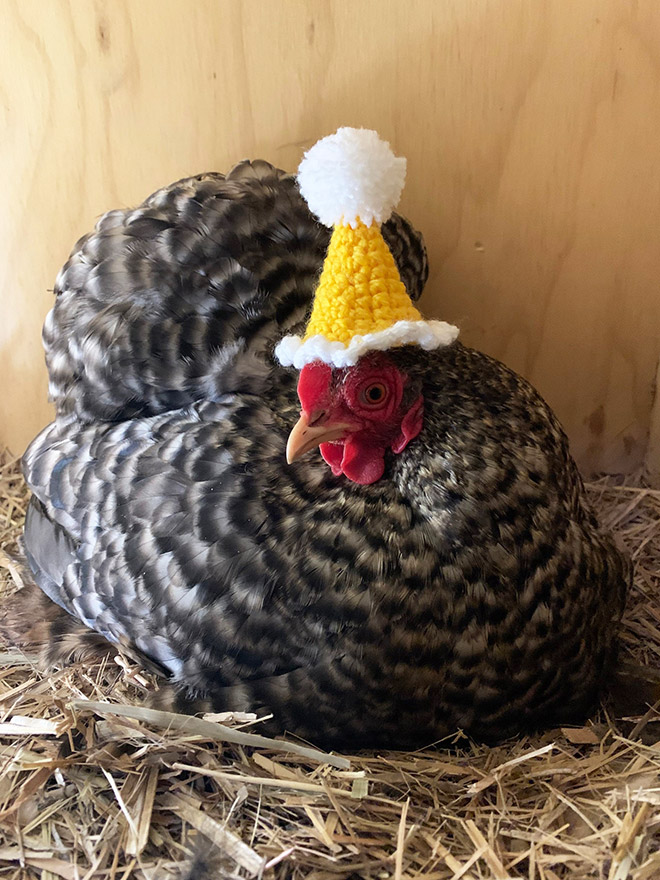
Where is `wall`? This screenshot has width=660, height=880. wall is located at coordinates (445, 81).